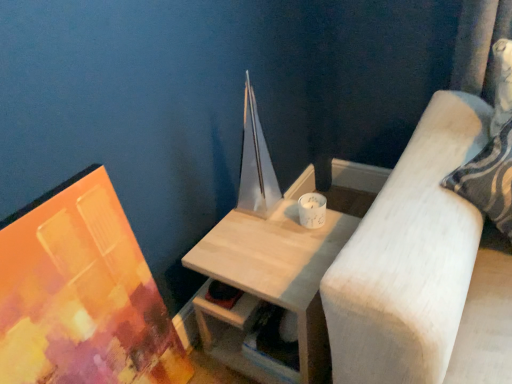
Question: Relative to matte acrylic painting at left, is white ceramic candle at upper right in front or behind?

Choices:
 (A) behind
 (B) front

Answer: (A)

Question: Is point (323, 223) positioned closer to the camera than point (151, 375)?

Choices:
 (A) closer
 (B) farther

Answer: (B)

Question: Considering the real-world distances, which object is farthest from the light wood table at center?

Choices:
 (A) matte acrylic painting at left
 (B) white ceramic candle at upper right

Answer: (A)

Question: Based on their relative distances, which object is farther from the white ceramic candle at upper right?

Choices:
 (A) matte acrylic painting at left
 (B) light wood table at center

Answer: (A)